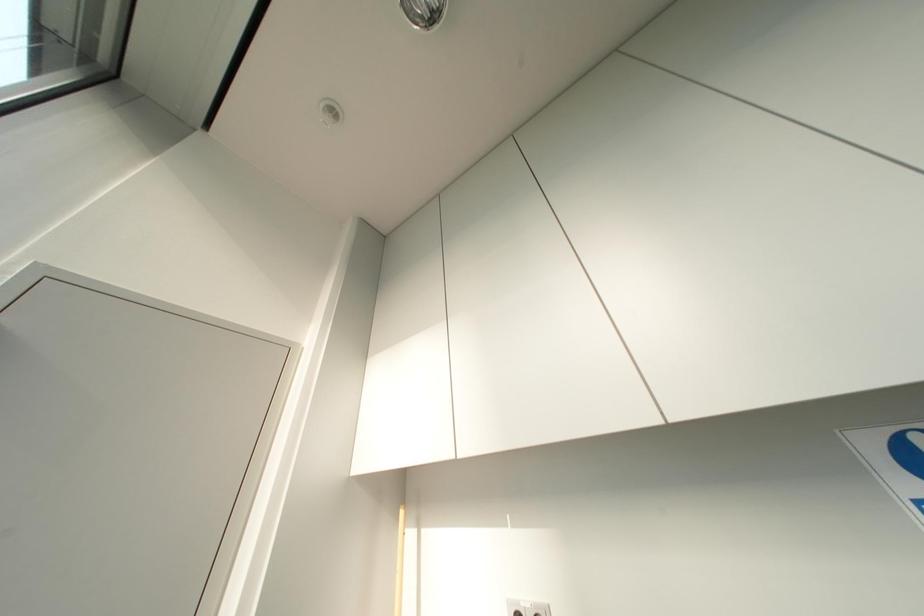
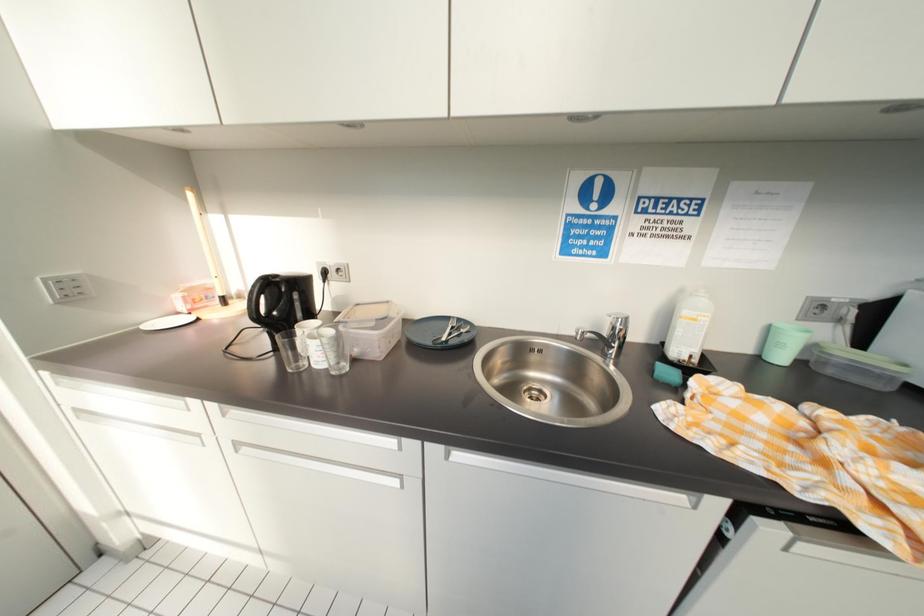
The first image is from the beginning of the video and the second image is from the end. How did the camera likely rotate when shooting the video?

The rotation direction of the camera is right-down.